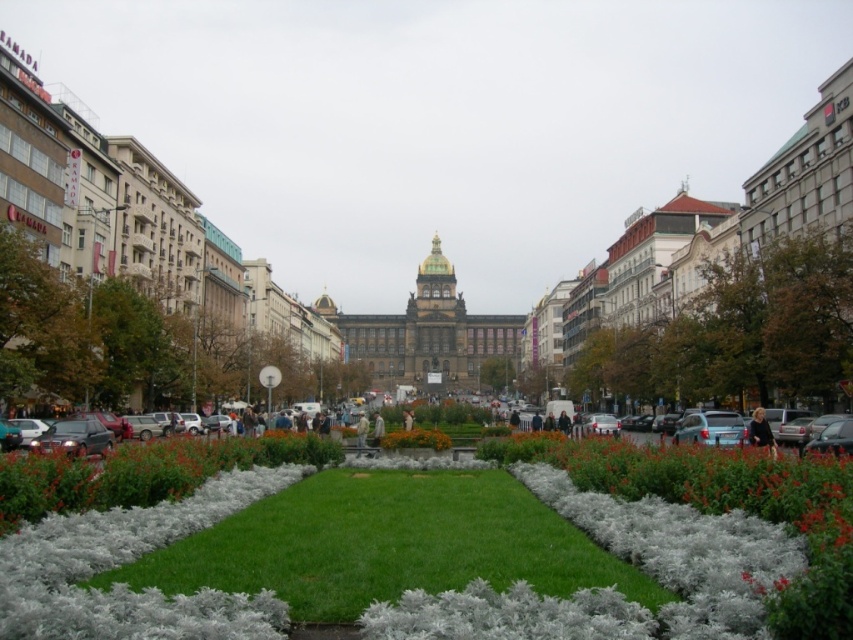
You are standing at the entrance of the urban square and want to walk towards the historical building at its center. There are two patches of grass in front of you labeled as green grass at center and green soft grass at center. Which grass patch should you step on if you want to stay on the right side of the pathway leading towards the building?

You should step on the green grass at center because it is positioned on the right side of green soft grass at center, aligning with the pathway leading towards the historical building.

You are planning to set up a small picnic area in the urban square. The picnic area requires a space wider than the orange matte flower bed at center. Can the green soft grass at center accommodate this requirement?

The green soft grass at center has a width that surpasses the orange matte flower bed at center, so yes, the green soft grass at center can accommodate the picnic area requiring a space wider than the orange matte flower bed at center.